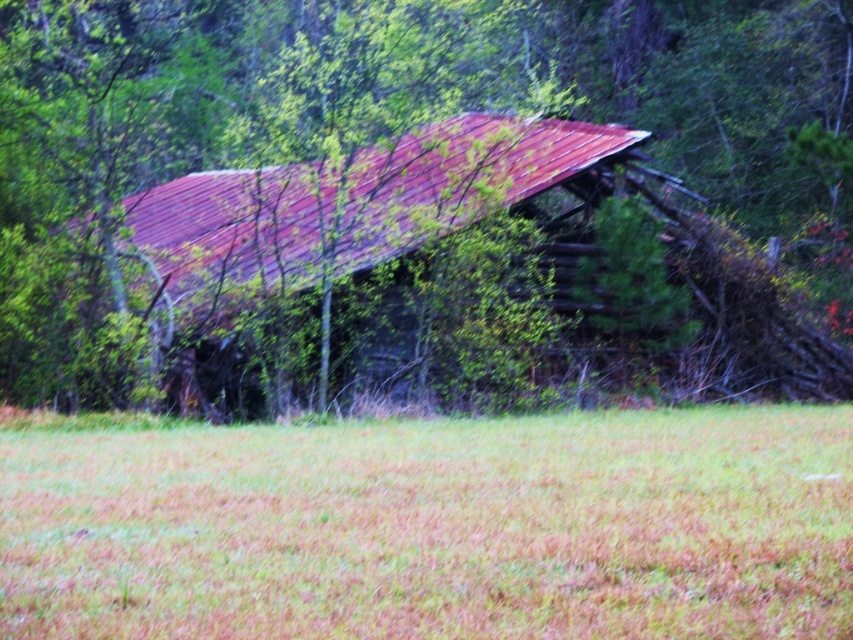
Does rusty metal roof at center appear on the left side of brown dry grass at center?

No, rusty metal roof at center is not to the left of brown dry grass at center.

Does point (709, 243) come in front of point (540, 632)?

No, (709, 243) is further to viewer.

Identify the location of rusty metal roof at center. (399, 184).